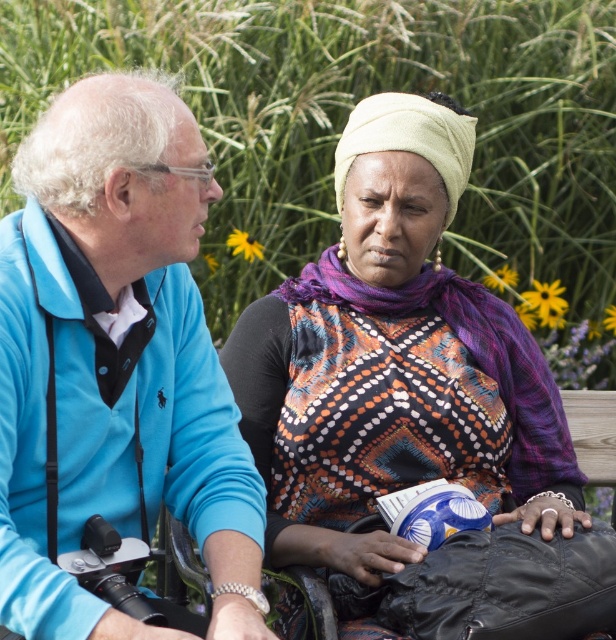
Question: Among these points, which one is farthest from the camera?

Choices:
 (A) (174, 493)
 (B) (479, 467)

Answer: (B)

Question: Which of the following is the farthest from the observer?

Choices:
 (A) (426, 467)
 (B) (67, 124)

Answer: (A)

Question: Does blue velvety cardigan at left have a larger size compared to patterned fabric scarf at center?

Choices:
 (A) yes
 (B) no

Answer: (B)

Question: Where is blue velvety cardigan at left located in relation to patterned fabric scarf at center in the image?

Choices:
 (A) below
 (B) above

Answer: (B)

Question: Among these objects, which one is farthest from the camera?

Choices:
 (A) blue velvety cardigan at left
 (B) patterned fabric scarf at center

Answer: (B)

Question: Is blue velvety cardigan at left wider than patterned fabric scarf at center?

Choices:
 (A) yes
 (B) no

Answer: (B)